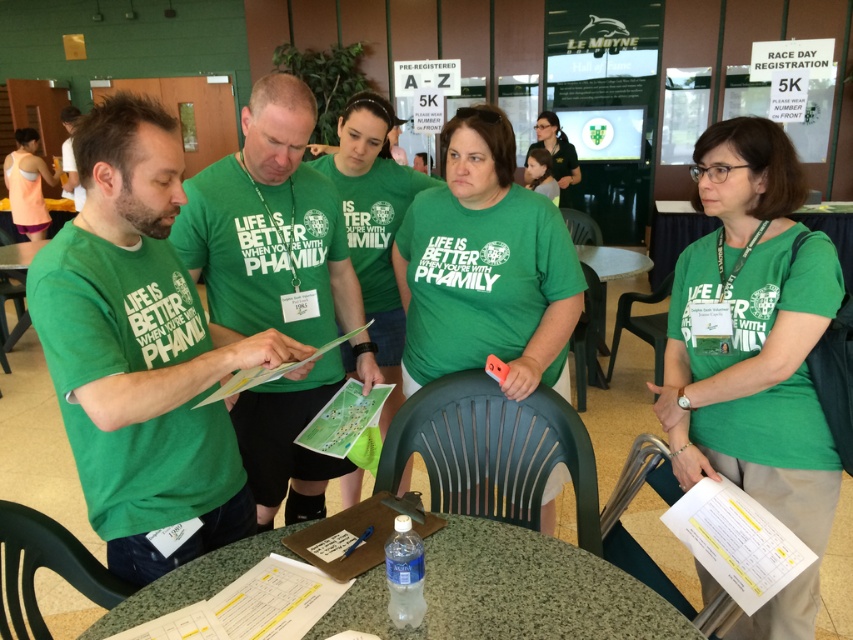
You are setting up for an event and need to place a banner between the green plastic table at center and the white plastic table at lower center. Based on their positions, which table should the banner be placed closer to?

The banner should be placed closer to the white plastic table at lower center because the green plastic table at center is to the left of it, meaning the white plastic table is on the right side relative to the green one.

You are standing at the center of the image and want to move towards the point with coordinates (28, 184). Which direction should you go?

The point with coordinates (28, 184) is located on the orange tank top at left, so you should move towards the left side of the image to reach it.